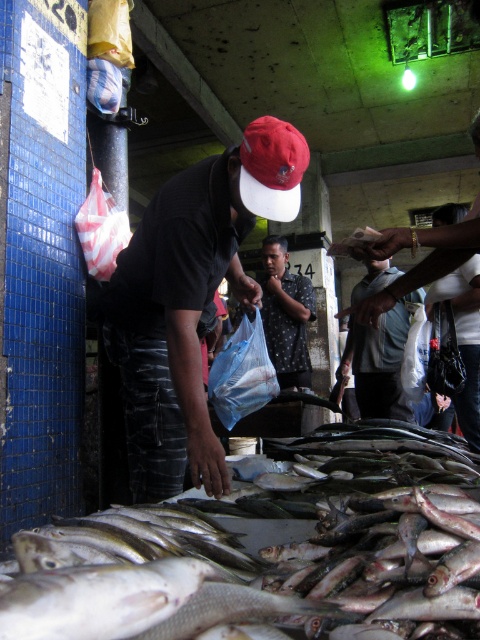
Is point (397, 548) closer to camera compared to point (363, 337)?

Yes, point (397, 548) is closer to viewer.

Which is above, shiny silver fish at lower center or light blue fabric shirt at center?

light blue fabric shirt at center is higher up.

Between point (13, 636) and point (371, 276), which one is positioned behind?

Positioned behind is point (371, 276).

Where is `shiny silver fish at lower center`? shiny silver fish at lower center is located at coordinates (282, 547).

Is matte black shirt at center further to camera compared to light blue fabric shirt at center?

That is False.

Who is positioned more to the left, matte black shirt at center or light blue fabric shirt at center?

matte black shirt at center

The height and width of the screenshot is (640, 480). Identify the location of matte black shirt at center. (190, 300).

You are a GUI agent. You are given a task and a screenshot of the screen. Output one action in this format:
    pyautogui.click(x=<x>, y=<y>)
    Task: Click on the matte black shirt at center
    
    Given the screenshot: What is the action you would take?
    pyautogui.click(x=190, y=300)

Can you confirm if shiny silver fish at lower center is thinner than dark gray dotted shirt at center?

In fact, shiny silver fish at lower center might be wider than dark gray dotted shirt at center.

Which is behind, point (327, 584) or point (277, 234)?

Positioned behind is point (277, 234).

You are a GUI agent. You are given a task and a screenshot of the screen. Output one action in this format:
    pyautogui.click(x=<x>, y=<y>)
    Task: Click on the shiny silver fish at lower center
    The height and width of the screenshot is (640, 480).
    Given the screenshot: What is the action you would take?
    pyautogui.click(x=282, y=547)